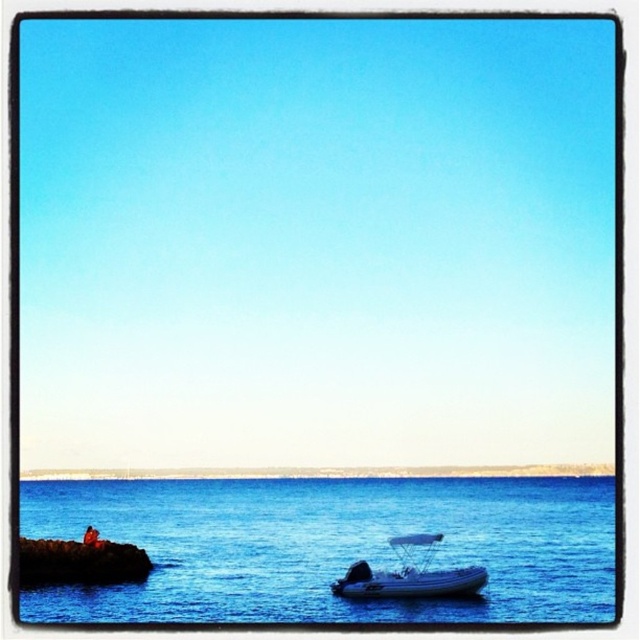
You are a swimmer who wants to reach the white rubber boat at lower center from the blue water at lower left. Given that your swimming speed is 1.5 meters per second, how long will it take you to reach the boat?

The blue water at lower left and white rubber boat at lower center are 117.34 meters apart from each other. At a swimming speed of 1.5 meters per second, it will take approximately 78.23 seconds to reach the boat.

You are standing at the point marked by the coordinates point (x=330, y=547) in the image. Based on the scene description, what would you see directly below you?

The point (x=330, y=547) indicates blue water at lower left, so you would see blue water directly below you.

You are standing on the shore looking at the scene. There are two points marked in the image. The first point is at coordinates point (20, 600) and the second point is at point (429, 544). Which point is closer to you?

Point (20, 600) is closer to you because it is further to the camera than point (429, 544).